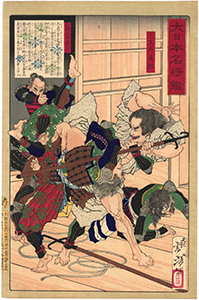
Locate an element on the screen. This screenshot has height=300, width=199. wall is located at coordinates (17, 110).